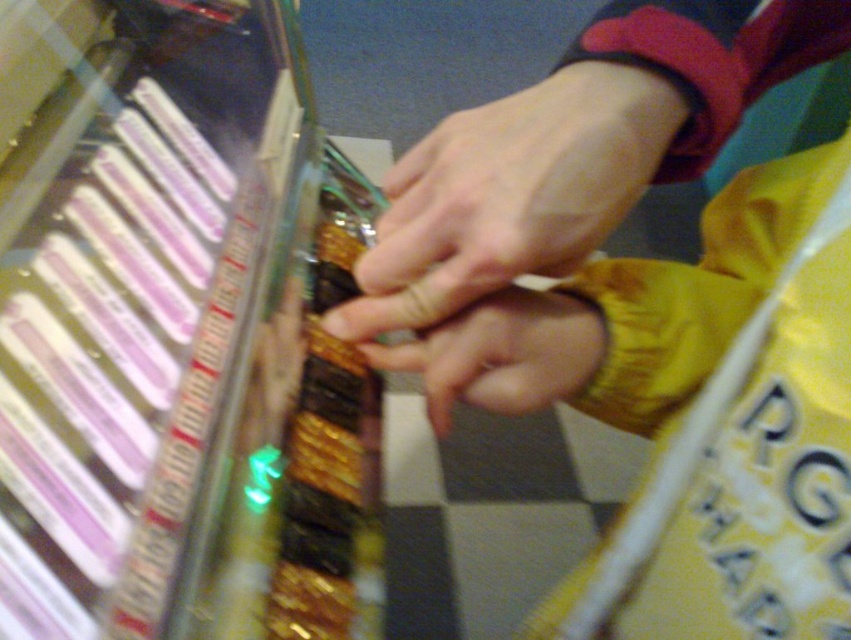
Is yellow fabric at center in front of smooth skin hand at center?

That is True.

Where is `yellow fabric at center`? yellow fabric at center is located at coordinates (647, 312).

The height and width of the screenshot is (640, 851). In order to click on yellow fabric at center in this screenshot , I will do `click(647, 312)`.

Where is `yellow fabric at center`? The width and height of the screenshot is (851, 640). yellow fabric at center is located at coordinates (647, 312).